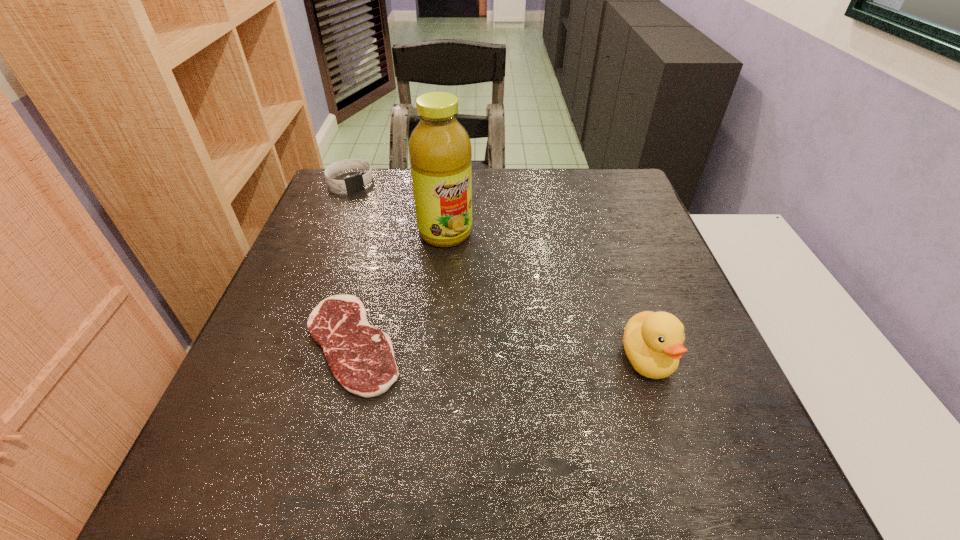
Find the location of a particular element. empty space that is in between the rightmost object and the shortest object is located at coordinates (500, 351).

Find the location of a particular element. free point between the fruit juice and the shortest object is located at coordinates (399, 288).

In order to click on free space between the tallest object and the shortest object in this screenshot , I will do `click(399, 288)`.

At what (x,y) coordinates should I click in order to perform the action: click on free space between the steak and the third nearest object. Please return your answer as a coordinate pair (x, y). Image resolution: width=960 pixels, height=540 pixels. Looking at the image, I should click on (x=399, y=288).

At what (x,y) coordinates should I click in order to perform the action: click on free space that is in between the farthest object and the third nearest object. Please return your answer as a coordinate pair (x, y). Image resolution: width=960 pixels, height=540 pixels. Looking at the image, I should click on tap(397, 207).

The image size is (960, 540). Find the location of `vacant point located between the wristband and the fruit juice`. vacant point located between the wristband and the fruit juice is located at coordinates pos(397,207).

Where is `unoccupied area between the shortest object and the tallest object`? unoccupied area between the shortest object and the tallest object is located at coordinates (399, 288).

Where is `vacant point located between the steak and the fruit juice`? The image size is (960, 540). vacant point located between the steak and the fruit juice is located at coordinates (399, 288).

Find the location of a particular element. Image resolution: width=960 pixels, height=540 pixels. object that is the closest to the steak is located at coordinates (439, 148).

Identify the location of object that is the closest one to the third tallest object. (439, 148).